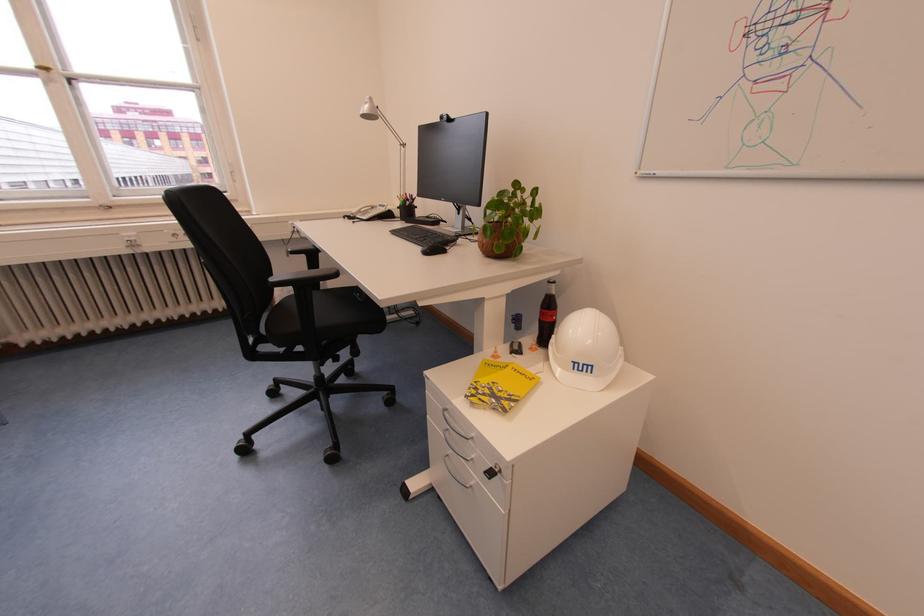
You are a GUI agent. You are given a task and a screenshot of the screen. Output one action in this format:
    pyautogui.click(x=<x>, y=<y>)
    Task: Click on the desk height button
    
    Given the screenshot: What is the action you would take?
    pyautogui.click(x=496, y=475)